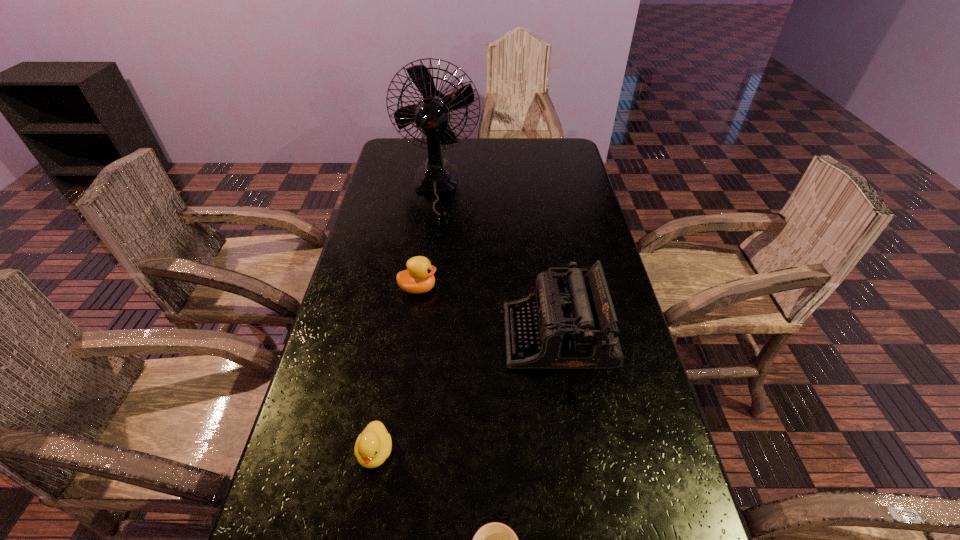
In order to click on free space located on the keyboard of the third farthest object in this screenshot , I will do `click(419, 336)`.

Identify the location of free spot located on the keyboard of the third farthest object. This screenshot has height=540, width=960. (430, 336).

Image resolution: width=960 pixels, height=540 pixels. I want to click on free location located 0.390m on the face of the third shortest object, so click(577, 288).

Locate an element on the screen. vacant space located 0.080m on the beak of the nearer duckling is located at coordinates [x=364, y=520].

Locate an element on the screen. object positioned at the far edge is located at coordinates (431, 115).

Where is `fan at the left edge`? The height and width of the screenshot is (540, 960). fan at the left edge is located at coordinates (431, 115).

This screenshot has width=960, height=540. I want to click on object situated at the right edge, so click(x=573, y=325).

Locate an element on the screen. object located at the far left corner is located at coordinates (431, 115).

In the image, there is a desktop. Identify the location of vacant space at the left edge. Image resolution: width=960 pixels, height=540 pixels. (342, 308).

Find the location of a particular element. This screenshot has width=960, height=540. free location at the right edge is located at coordinates (552, 245).